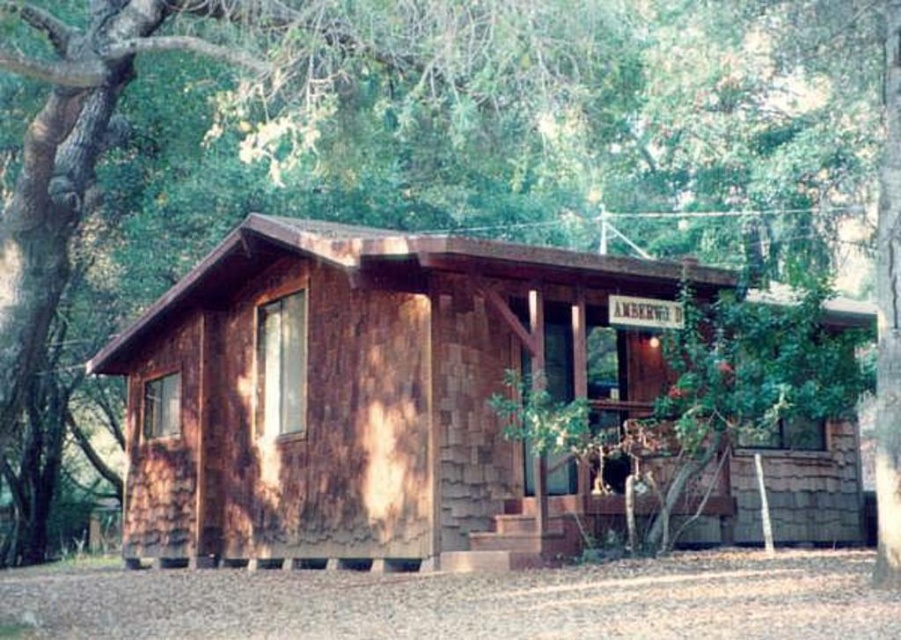
Who is shorter, green leafy tree at upper center or weathered wood cabin at center?

Standing shorter between the two is weathered wood cabin at center.

Between point (41, 205) and point (431, 432), which one is positioned behind?

Positioned behind is point (431, 432).

At what (x,y) coordinates should I click in order to perform the action: click on green leafy tree at upper center. Please return your answer as a coordinate pair (x, y). Looking at the image, I should click on (343, 131).

This screenshot has width=901, height=640. What are the coordinates of `green leafy tree at upper center` in the screenshot? It's located at (343, 131).